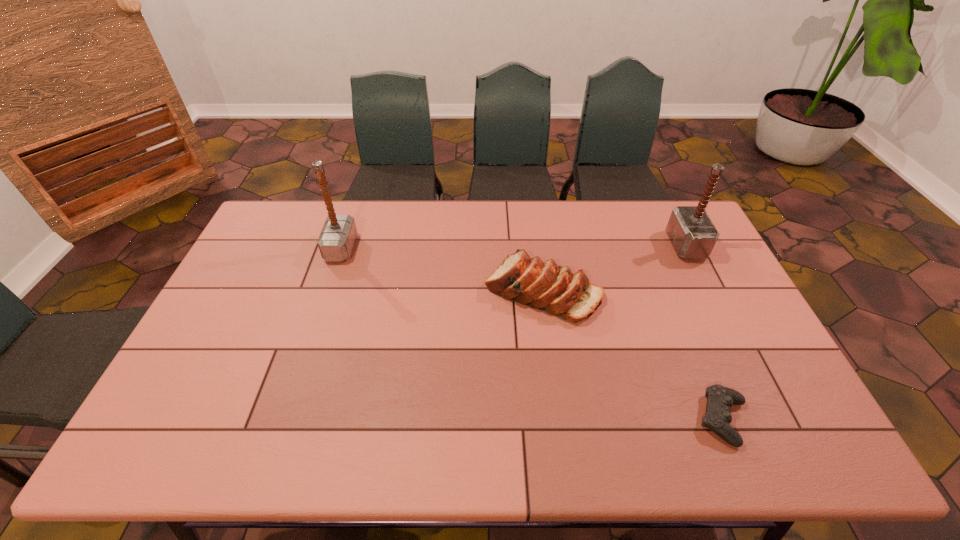
Image resolution: width=960 pixels, height=540 pixels. What are the coordinates of `vacant space that satisfies the following two spatial constraints: 1. on the back side of the bread; 2. on the striking surface of the leftmost object` in the screenshot? It's located at (537, 248).

Find the location of a particular element. free spot that satisfies the following two spatial constraints: 1. on the striking surface of the left hammer; 2. on the right side of the second object from left to right is located at coordinates (326, 291).

What are the coordinates of `free space in the image that satisfies the following two spatial constraints: 1. on the back side of the right hammer; 2. on the right side of the nearest object` in the screenshot? It's located at (651, 246).

The image size is (960, 540). I want to click on free spot that satisfies the following two spatial constraints: 1. on the striking surface of the left hammer; 2. on the back side of the shortest object, so tap(284, 420).

This screenshot has height=540, width=960. I want to click on free space that satisfies the following two spatial constraints: 1. on the back side of the right hammer; 2. on the right side of the second shortest object, so click(x=537, y=246).

Identify the location of free point that satisfies the following two spatial constraints: 1. on the back side of the shortest object; 2. on the striking surface of the leftmost object. This screenshot has width=960, height=540. click(652, 248).

Where is `vacant space that satisfies the following two spatial constraints: 1. on the back side of the third object from right to left; 2. on the striking surface of the left hammer`? vacant space that satisfies the following two spatial constraints: 1. on the back side of the third object from right to left; 2. on the striking surface of the left hammer is located at coordinates (537, 248).

Locate an element on the screen. vacant point that satisfies the following two spatial constraints: 1. on the back side of the third tallest object; 2. on the striking surface of the left hammer is located at coordinates (537, 248).